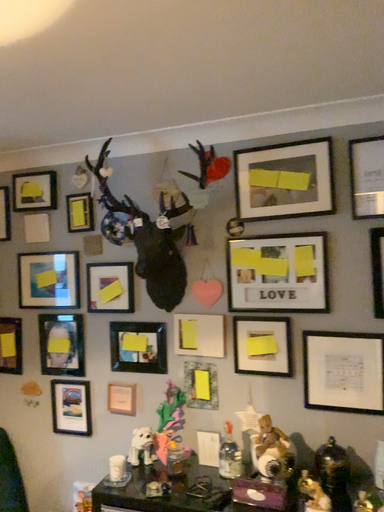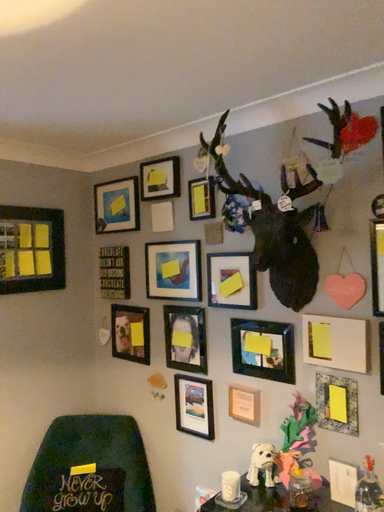
Question: Which way did the camera rotate in the video?

Choices:
 (A) rotated right
 (B) rotated left

Answer: (B)